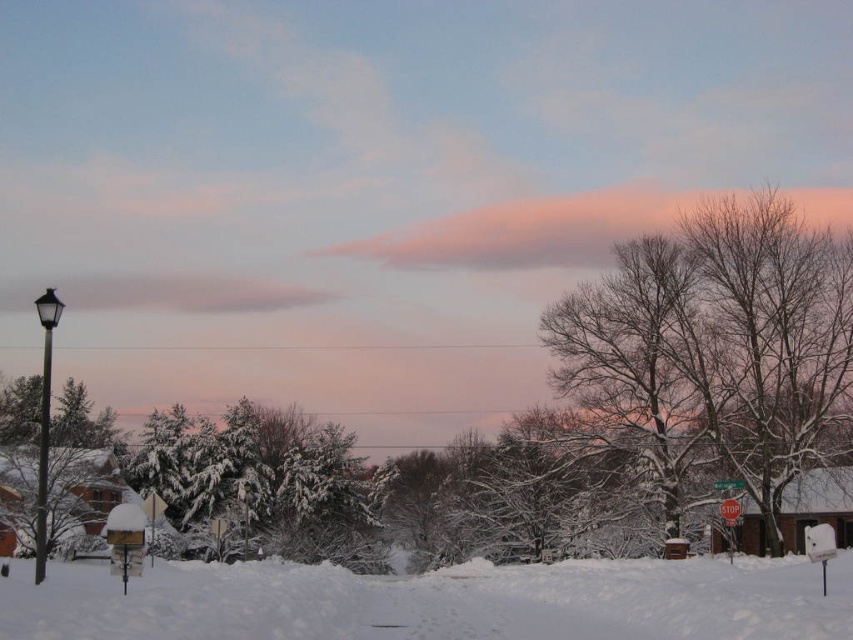
You are a bird looking for a place to perch. You see the bare branches at upper right and the black metal lamp post at left. Which one is taller and would allow you to see farther?

The bare branches at upper right is much taller than the black metal lamp post at left, so it would allow you to see farther.

You are standing in the winter scene at dusk. There is a point at coordinates (436, 602). What is located at that point?

The white fluffy snow at lower center is located at point (436, 602).